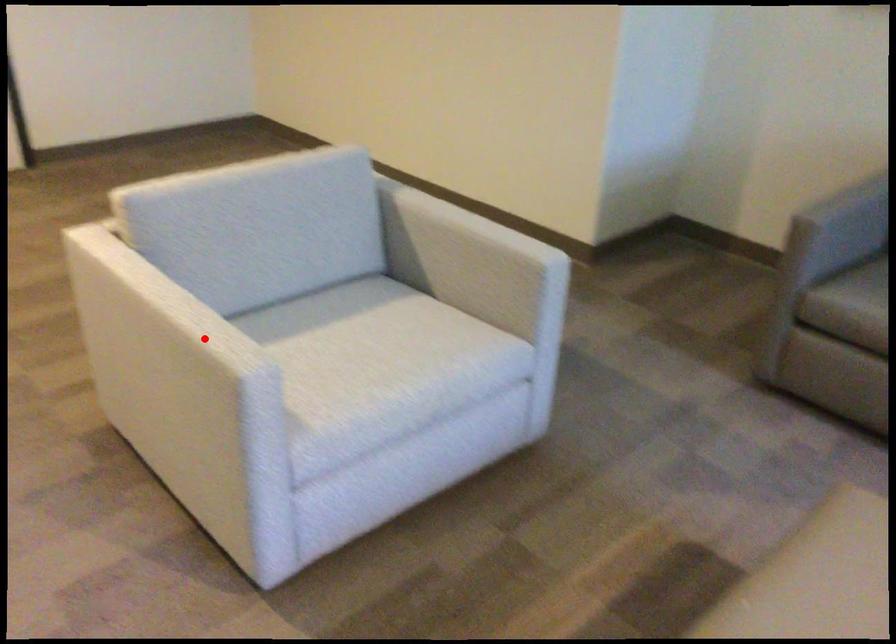
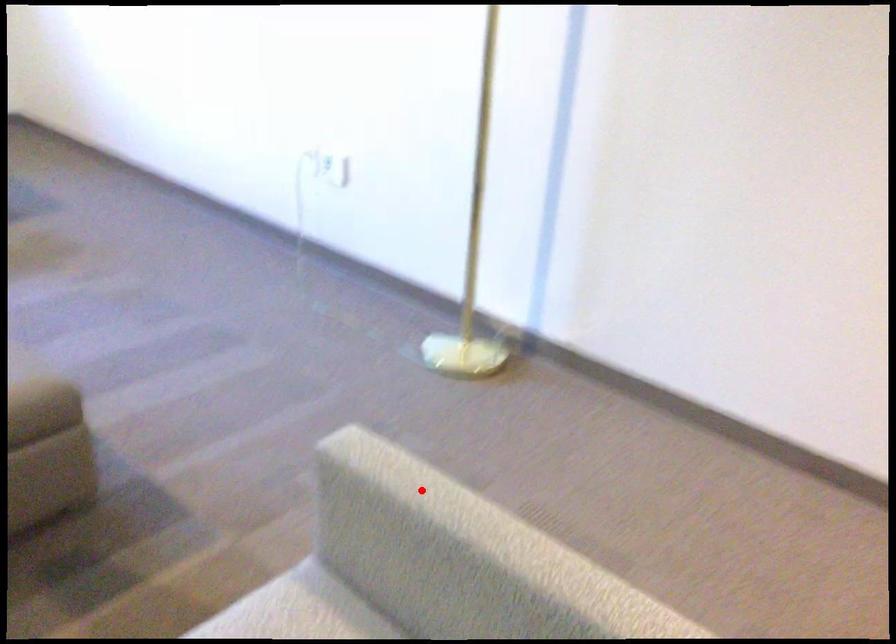
I am providing you with two images of the same scene from different viewpoints. A red point is marked on the first image and another point is marked on the second image. Do the highlighted points in image1 and image2 indicate the same real-world spot?

Yes